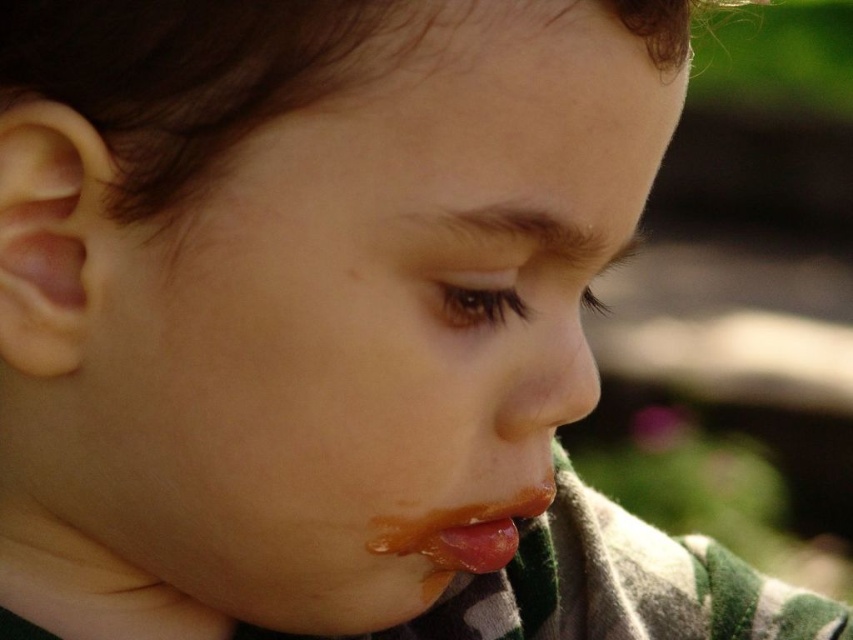
Is point (107, 451) more distant than point (490, 504)?

No.

Is smooth skin face at center wider than glossy orange lips at lower center?

Indeed, smooth skin face at center has a greater width compared to glossy orange lips at lower center.

Which is behind, point (618, 51) or point (508, 547)?

The point (508, 547) is behind.

The image size is (853, 640). Identify the location of smooth skin face at center. [368, 310].